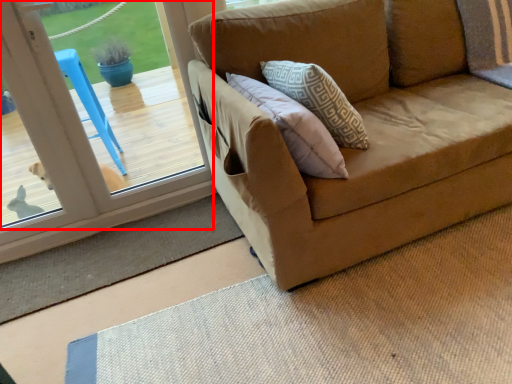
Question: From the image's perspective, what is the correct spatial relationship of window (annotated by the red box) in relation to doormat?

Choices:
 (A) above
 (B) below

Answer: (A)